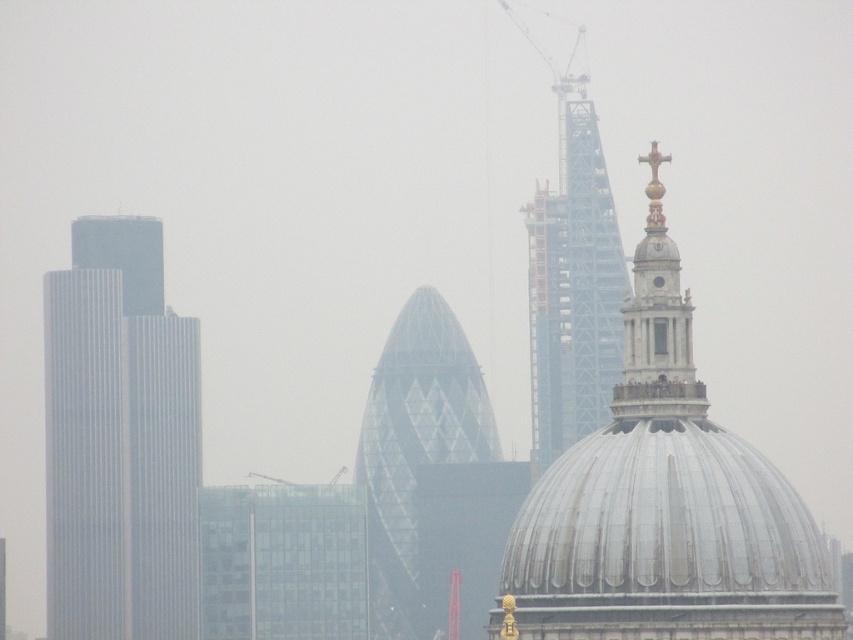
Question: Which of the following is the closest to the observer?

Choices:
 (A) (444, 362)
 (B) (645, 225)
 (C) (555, 600)

Answer: (C)

Question: Which object is positioned farthest from the smooth glass skyscraper at left?

Choices:
 (A) glassy steel tower at upper center
 (B) glassy triangular building at center

Answer: (A)

Question: Which object is the farthest from the glassy steel tower at upper center?

Choices:
 (A) shiny silver dome at center
 (B) smooth glass skyscraper at left

Answer: (A)

Question: Does shiny silver dome at center appear on the left side of glassy triangular building at center?

Choices:
 (A) yes
 (B) no

Answer: (B)

Question: Is shiny silver dome at center smaller than glassy steel tower at upper center?

Choices:
 (A) yes
 (B) no

Answer: (A)

Question: Can you confirm if glassy triangular building at center is positioned above gold polished cross at upper center?

Choices:
 (A) no
 (B) yes

Answer: (A)